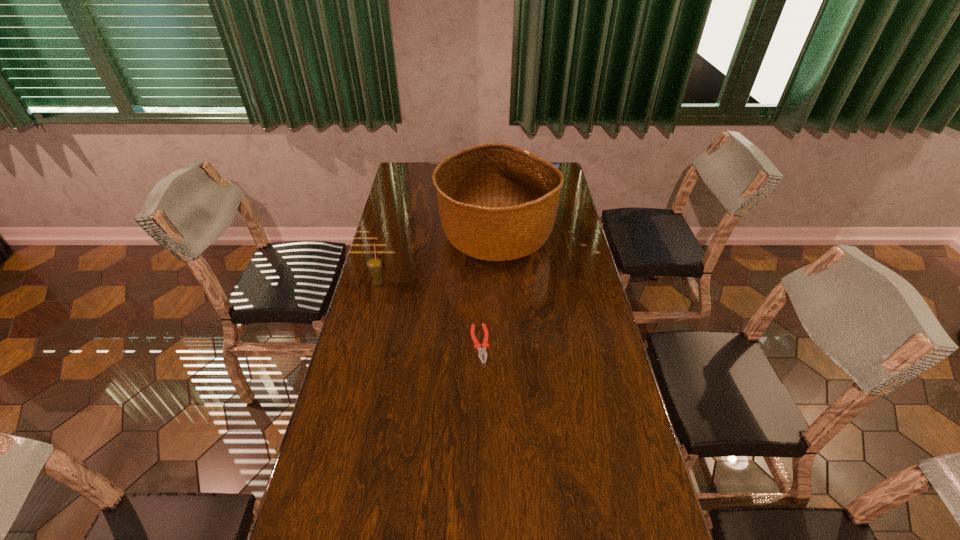
Point out which object is positioned as the second nearest to the pliers. Please provide its 2D coordinates. Your answer should be formatted as a tuple, i.e. [(x, y)], where the tuple contains the x and y coordinates of a point satisfying the conditions above.

[(374, 264)]

Find the location of a particular element. The image size is (960, 540). the second closest object to the leftmost object is located at coordinates (482, 351).